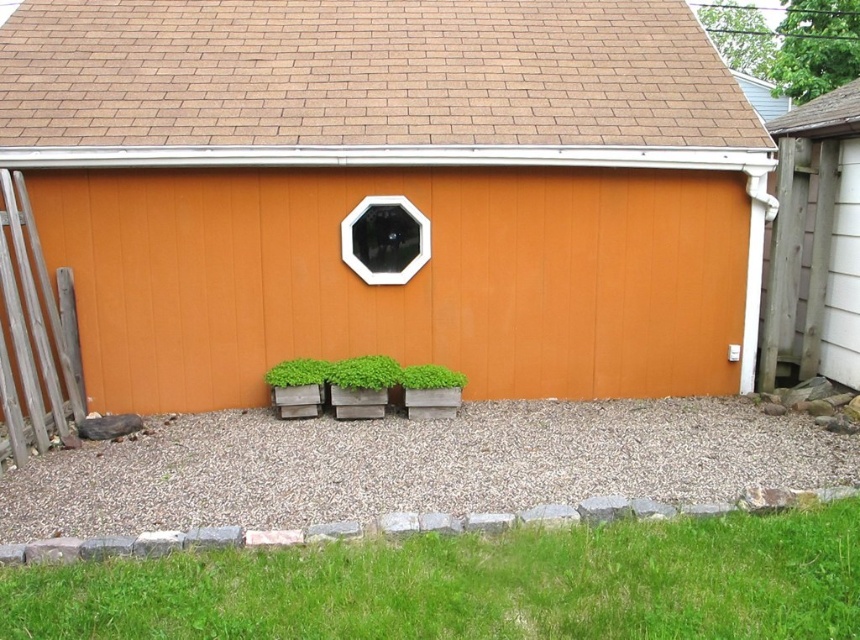
Question: Which point is farther to the camera?

Choices:
 (A) (361, 227)
 (B) (363, 384)

Answer: (A)

Question: Is orange wood barn at center closer to the viewer compared to weathered wood shed at right?

Choices:
 (A) no
 (B) yes

Answer: (B)

Question: Can you confirm if weathered wood fence at left is wider than green matte planter at lower center?

Choices:
 (A) yes
 (B) no

Answer: (A)

Question: Considering the real-world distances, which object is closest to the weathered wood shed at right?

Choices:
 (A) green matte planter at center
 (B) gray gravel at center
 (C) transparent glass window at center
 (D) green matte planter at lower center

Answer: (B)

Question: Among these points, which one is nearest to the camera?

Choices:
 (A) (384, 355)
 (B) (502, 253)
 (C) (613, 557)
 (D) (766, 340)

Answer: (C)

Question: Is orange wood barn at center bigger than green grass at lower center?

Choices:
 (A) yes
 (B) no

Answer: (A)